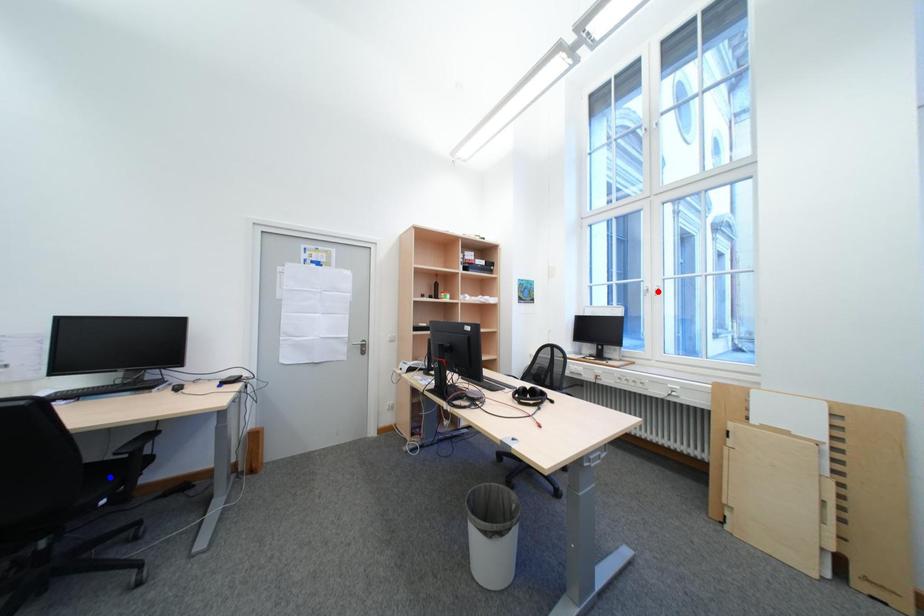
Question: In the image, two points are highlighted. Which point is nearer to the camera? Reply with the corresponding letter.

Choices:
 (A) blue point
 (B) red point

Answer: (A)